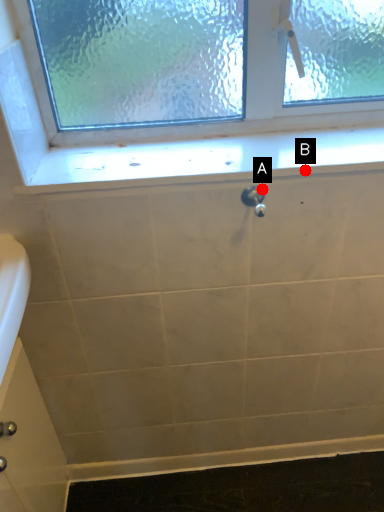
Question: Two points are circled on the image, labeled by A and B beside each circle. Which point is farther to the camera?

Choices:
 (A) A is further
 (B) B is further

Answer: (A)